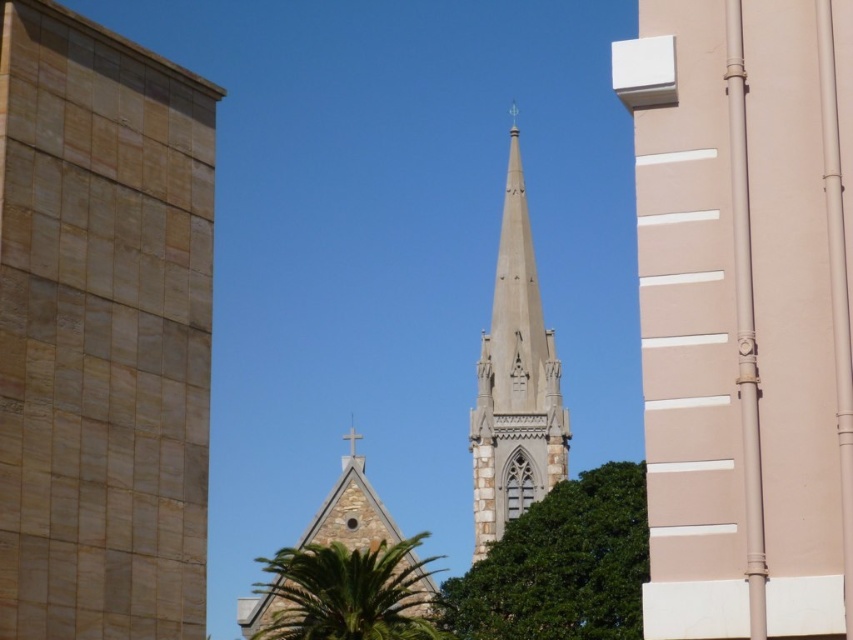
You are standing in front of the architectural scene described. There are two points marked in the image, one at coordinates point (840, 362) and another at point (431, 595). Which point is closer to you?

Point (840, 362) is closer to the viewer than point (431, 595).